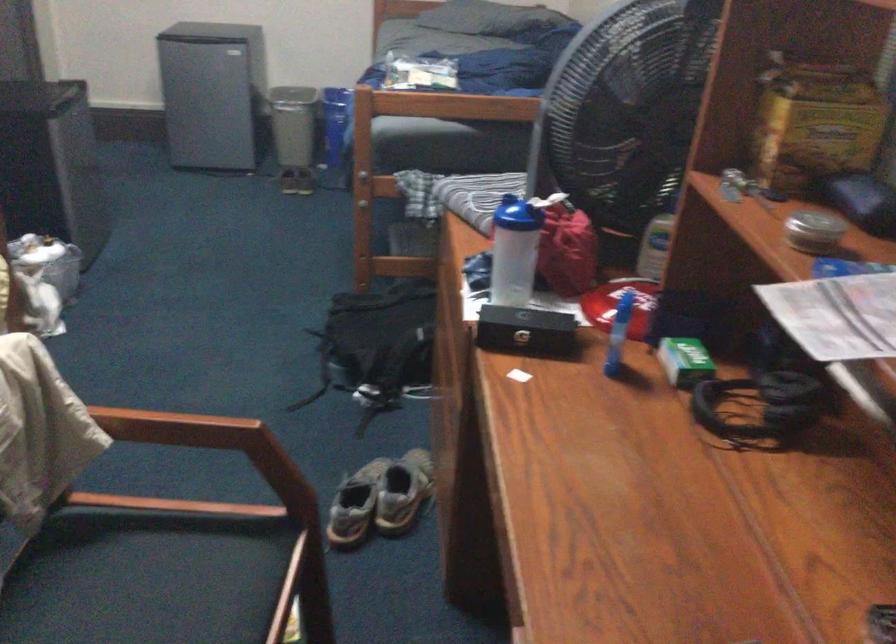
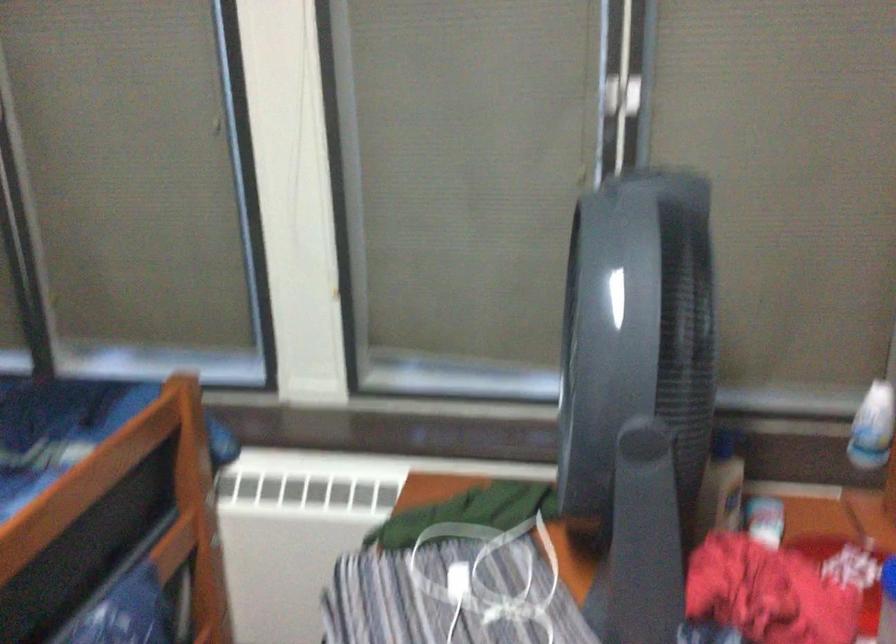
Where in the second image is the point corresponding to point 530,162 from the first image?

(645, 521)